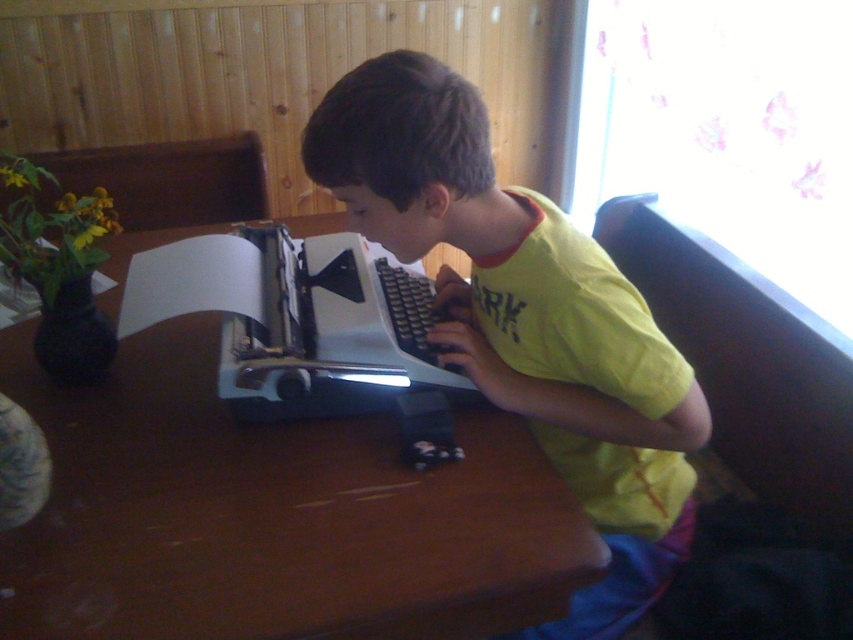
Question: Which point is closer to the camera taking this photo?

Choices:
 (A) (469, 346)
 (B) (495, 560)

Answer: (B)

Question: Does brown wooden table at center appear under yellow cotton shirt at center?

Choices:
 (A) yes
 (B) no

Answer: (A)

Question: Does brown wooden table at center appear over yellow cotton shirt at center?

Choices:
 (A) no
 (B) yes

Answer: (A)

Question: Is brown wooden table at center to the left of yellow cotton shirt at center from the viewer's perspective?

Choices:
 (A) no
 (B) yes

Answer: (B)